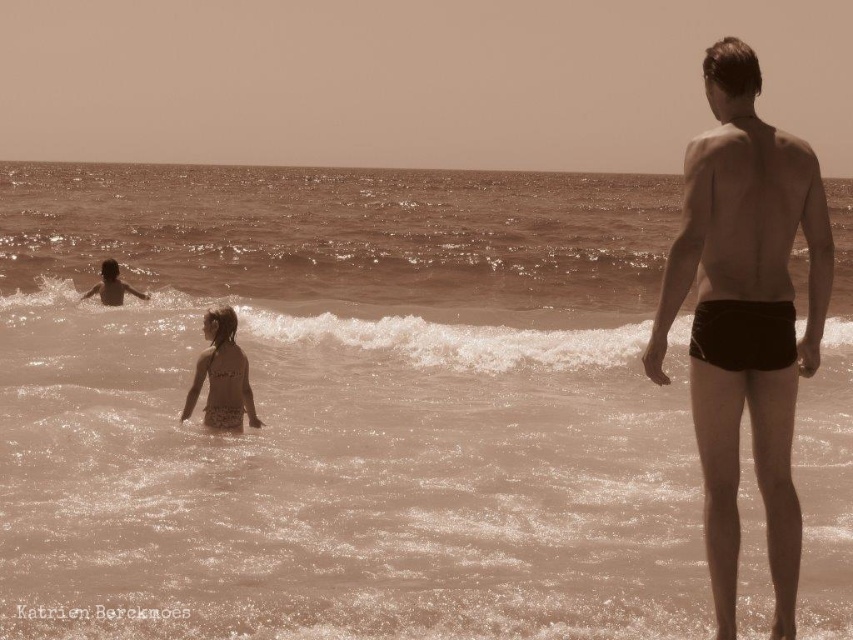
Between black matte shorts at right and white frothy wave at center, which one appears on the right side from the viewer's perspective?

black matte shorts at right is more to the right.

What do you see at coordinates (746, 317) in the screenshot? I see `black matte shorts at right` at bounding box center [746, 317].

Between point (677, 269) and point (581, 326), which one is positioned behind?

Point (581, 326)

Where is `black matte shorts at right`? black matte shorts at right is located at coordinates (746, 317).

Does beige textured swimsuit at center appear on the right side of smooth skin child at left?

Indeed, beige textured swimsuit at center is positioned on the right side of smooth skin child at left.

Consider the image. Does beige textured swimsuit at center lie behind smooth skin child at left?

No.

The height and width of the screenshot is (640, 853). I want to click on beige textured swimsuit at center, so click(221, 376).

The image size is (853, 640). In order to click on beige textured swimsuit at center in this screenshot , I will do `click(221, 376)`.

Which is more to the right, white frothy wave at center or beige textured swimsuit at center?

white frothy wave at center is more to the right.

What do you see at coordinates (326, 330) in the screenshot? Image resolution: width=853 pixels, height=640 pixels. I see `white frothy wave at center` at bounding box center [326, 330].

You are a GUI agent. You are given a task and a screenshot of the screen. Output one action in this format:
    pyautogui.click(x=<x>, y=<y>)
    Task: Click on the white frothy wave at center
    This screenshot has width=853, height=640.
    Given the screenshot: What is the action you would take?
    pyautogui.click(x=326, y=330)